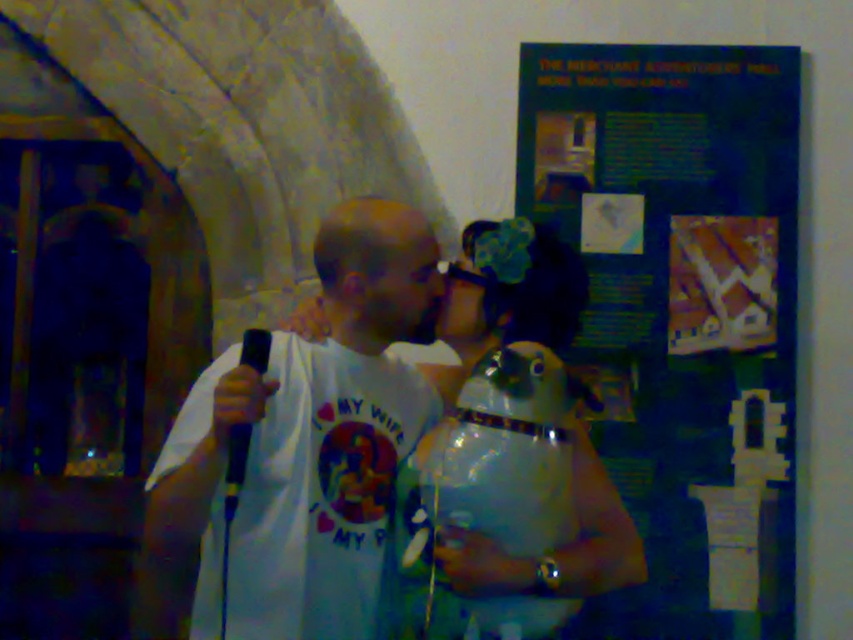
Question: Does white t-shirt at center have a larger size compared to transparent plastic bag at center?

Choices:
 (A) yes
 (B) no

Answer: (A)

Question: Which object is farther from the camera taking this photo?

Choices:
 (A) white t-shirt at center
 (B) transparent plastic bag at center

Answer: (B)

Question: Is white t-shirt at center thinner than transparent plastic bag at center?

Choices:
 (A) no
 (B) yes

Answer: (A)

Question: Can you confirm if white t-shirt at center is positioned below transparent plastic bag at center?

Choices:
 (A) yes
 (B) no

Answer: (B)

Question: Which of the following is the farthest from the observer?

Choices:
 (A) transparent plastic bag at center
 (B) white t-shirt at center

Answer: (A)